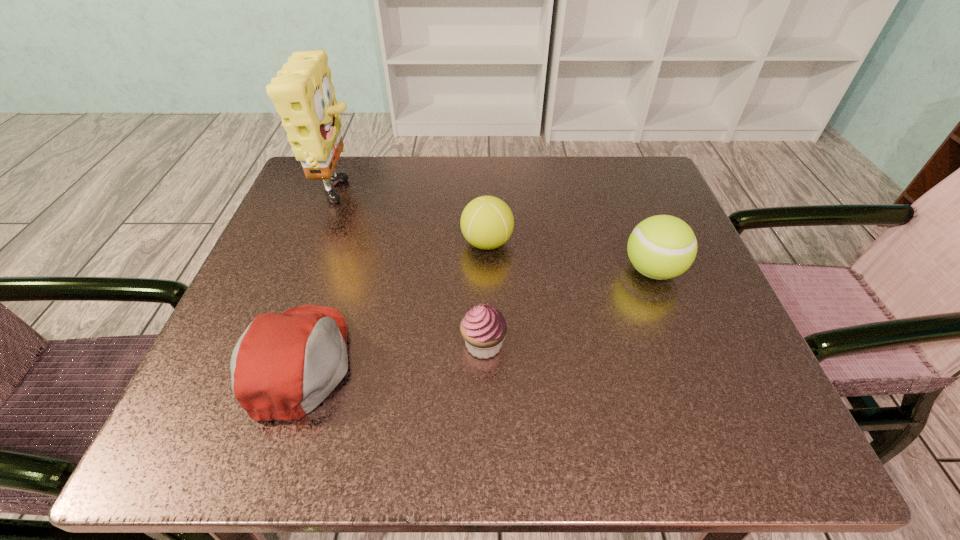
Find the location of `the tallest object`. the tallest object is located at coordinates (302, 92).

Locate an element on the screen. the right tennis ball is located at coordinates (661, 247).

At what (x,y) coordinates should I click in order to perform the action: click on the left tennis ball. Please return your answer as a coordinate pair (x, y). Image resolution: width=960 pixels, height=540 pixels. Looking at the image, I should click on (487, 222).

Locate an element on the screen. The height and width of the screenshot is (540, 960). cupcake is located at coordinates tap(483, 328).

This screenshot has height=540, width=960. In order to click on cap in this screenshot , I will do `click(284, 365)`.

Find the location of a particular element. This screenshot has width=960, height=540. free space located 0.280m on the face of the sponge is located at coordinates (492, 198).

Locate an element on the screen. Image resolution: width=960 pixels, height=540 pixels. free space located on the left of the right tennis ball is located at coordinates (424, 271).

This screenshot has width=960, height=540. What are the coordinates of `vacant area situated 0.240m on the back of the left tennis ball` in the screenshot? It's located at pos(486,163).

Find the location of a particular element. The width and height of the screenshot is (960, 540). vacant space located 0.250m on the right of the cupcake is located at coordinates (665, 345).

The height and width of the screenshot is (540, 960). Identify the location of free region located 0.250m on the front-facing side of the cap. (516, 362).